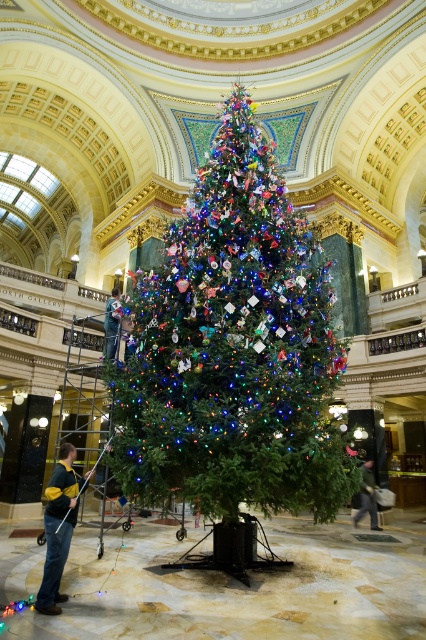
Question: Is denim jacket at lower right to the left of green fabric at center from the viewer's perspective?

Choices:
 (A) yes
 (B) no

Answer: (B)

Question: Which point is closer to the camera?

Choices:
 (A) (291, 330)
 (B) (71, 480)

Answer: (B)

Question: Is green fleece jacket at lower left above denim jacket at lower right?

Choices:
 (A) yes
 (B) no

Answer: (B)

Question: Among these objects, which one is nearest to the camera?

Choices:
 (A) green fleece jacket at lower left
 (B) green fabric at center
 (C) green matte christmas tree at center

Answer: (A)

Question: Is denim jacket at lower right closer to the viewer compared to green fabric at center?

Choices:
 (A) no
 (B) yes

Answer: (B)

Question: Among these points, which one is farthest from the camera?

Choices:
 (A) (215, 276)
 (B) (57, 547)

Answer: (A)